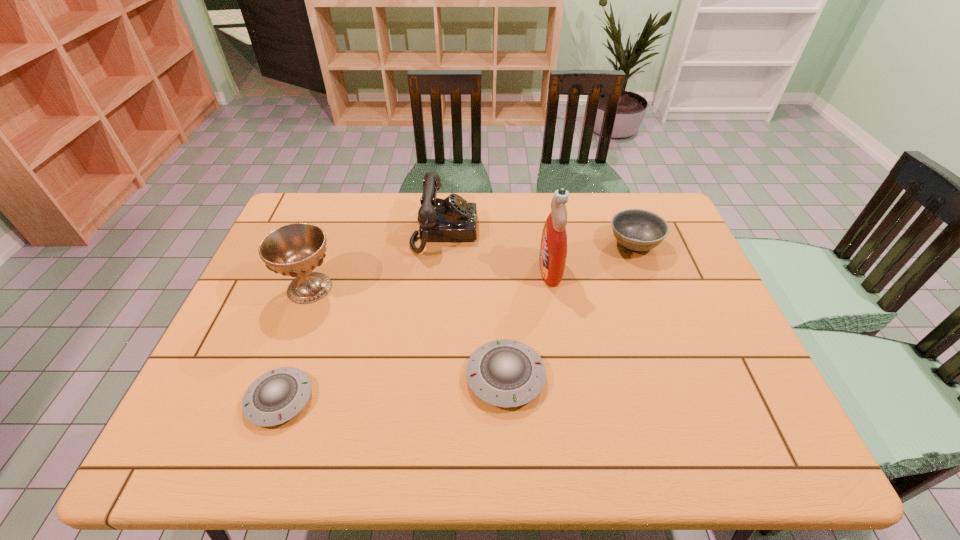
Locate an element on the screen. This screenshot has height=540, width=960. object that is the third closest to the bowl is located at coordinates (451, 219).

Identify which object is located as the third nearest to the second shortest object. Please provide its 2D coordinates. Your answer should be formatted as a tuple, i.e. [(x, y)], where the tuple contains the x and y coordinates of a point satisfying the conditions above.

[(278, 395)]

You are a GUI agent. You are given a task and a screenshot of the screen. Output one action in this format:
    pyautogui.click(x=<x>, y=<y>)
    Task: Click on the vacant position in the image that satisfies the following two spatial constraints: 1. on the dial of the fourth tallest object; 2. on the right side of the telephone
    Image resolution: width=960 pixels, height=540 pixels.
    Given the screenshot: What is the action you would take?
    pyautogui.click(x=444, y=244)

The image size is (960, 540). I want to click on blank area in the image that satisfies the following two spatial constraints: 1. on the dial of the telephone; 2. on the back side of the rightmost object, so click(x=444, y=244).

Identify the location of vacant point that satisfies the following two spatial constraints: 1. on the dial of the telephone; 2. on the left side of the third shortest object. (444, 244).

Identify the location of vacant region that satisfies the following two spatial constraints: 1. on the back side of the rightmost object; 2. on the dial of the telephone. The height and width of the screenshot is (540, 960). (629, 231).

You are a GUI agent. You are given a task and a screenshot of the screen. Output one action in this format:
    pyautogui.click(x=<x>, y=<y>)
    Task: Click on the free space that satisfies the following two spatial constraints: 1. on the dial of the bowl; 2. on the right side of the telephone
    This screenshot has width=960, height=540.
    Given the screenshot: What is the action you would take?
    pyautogui.click(x=444, y=244)